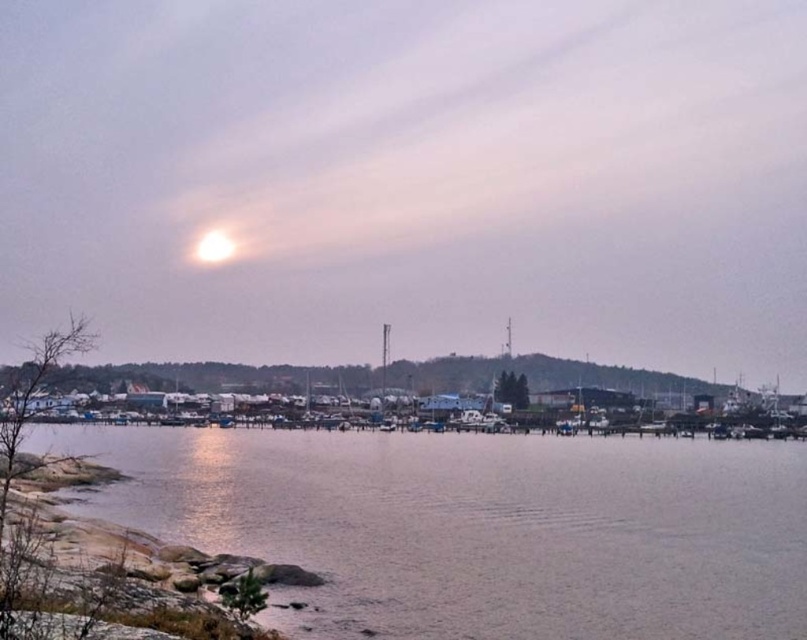
Between smooth water at lower center and bright white orb at upper center, which one has more height?

With more height is smooth water at lower center.

Is point (530, 461) positioned after point (228, 246)?

No, it is in front of (228, 246).

Is point (651, 531) positioned behind point (220, 257)?

That is False.

Locate an element on the screen. smooth water at lower center is located at coordinates tap(479, 528).